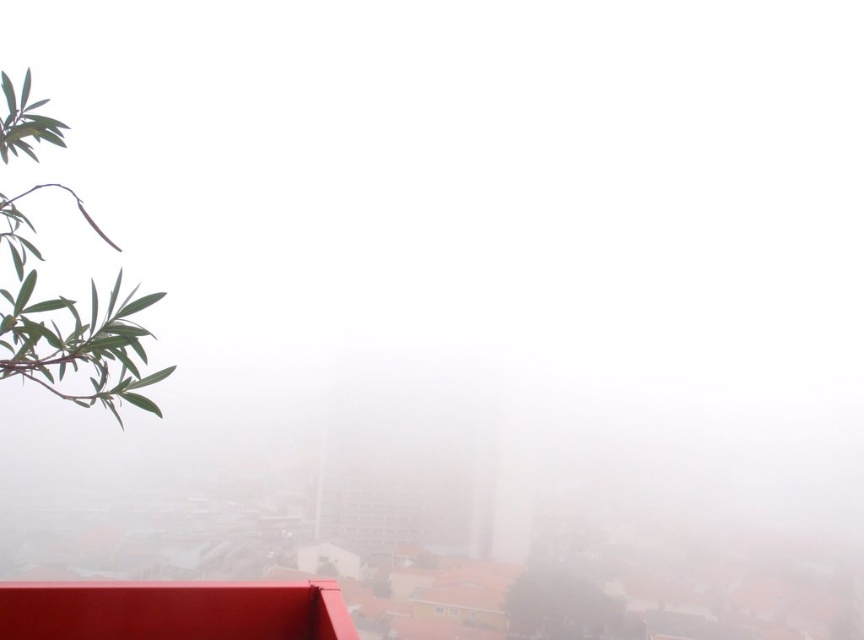
Question: Which object is farther from the camera taking this photo?

Choices:
 (A) green leafy olive tree at lower left
 (B) green leafy branch at upper left

Answer: (A)

Question: Is green leafy branch at upper left positioned before green leafy olive tree at lower left?

Choices:
 (A) no
 (B) yes

Answer: (B)

Question: Is green leafy branch at upper left smaller than green leafy olive tree at lower left?

Choices:
 (A) yes
 (B) no

Answer: (B)

Question: Which point is farther to the camera?

Choices:
 (A) green leafy olive tree at lower left
 (B) green leafy branch at upper left

Answer: (A)

Question: Does green leafy branch at upper left have a smaller size compared to green leafy olive tree at lower left?

Choices:
 (A) no
 (B) yes

Answer: (A)

Question: Which point is closer to the camera?

Choices:
 (A) green leafy branch at upper left
 (B) green leafy olive tree at lower left

Answer: (A)